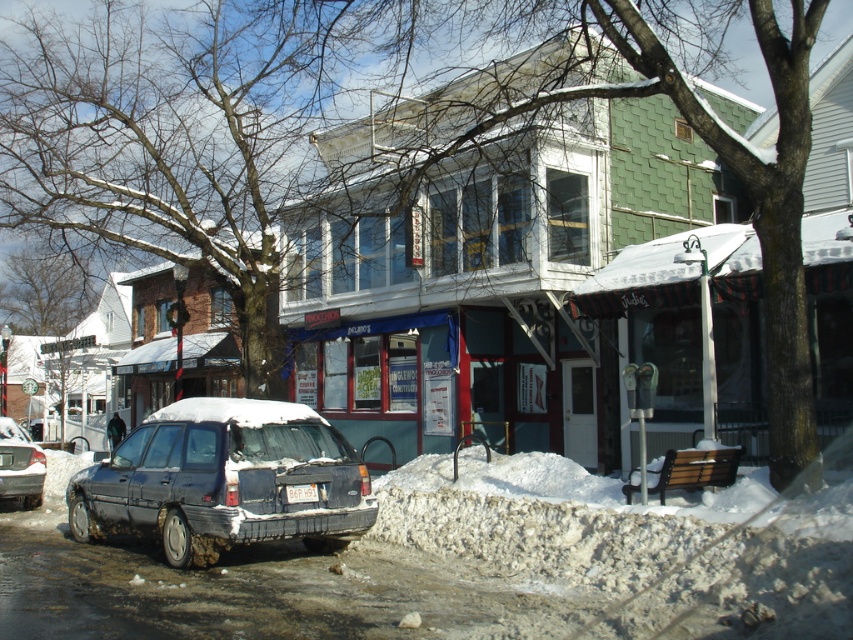
Question: Is dirty metallic car at center bigger than green shingled building at center?

Choices:
 (A) no
 (B) yes

Answer: (B)

Question: Does blue painted storefront at center lie behind matte gray station wagon at lower left?

Choices:
 (A) yes
 (B) no

Answer: (A)

Question: Does green shingled building at center appear under matte gray station wagon at lower left?

Choices:
 (A) yes
 (B) no

Answer: (B)

Question: Among these points, which one is farthest from the camera?

Choices:
 (A) (642, 355)
 (B) (1, 422)

Answer: (B)

Question: Which point appears closest to the camera in this image?

Choices:
 (A) (480, 392)
 (B) (286, 444)

Answer: (B)

Question: Among these points, which one is nearest to the camera?

Choices:
 (A) (399, 372)
 (B) (13, 472)

Answer: (B)